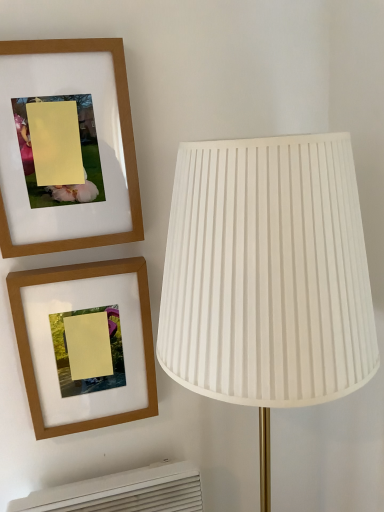
Question: Does white plastic air conditioner at lower left appear on the right side of wooden frame at upper left, the 2th picture frame from the top?

Choices:
 (A) yes
 (B) no

Answer: (A)

Question: Is white plastic air conditioner at lower left positioned with its back to wooden frame at upper left, the first picture frame ordered from the bottom?

Choices:
 (A) no
 (B) yes

Answer: (A)

Question: From a real-world perspective, is white plastic air conditioner at lower left on wooden frame at upper left, the 2th picture frame from the top?

Choices:
 (A) no
 (B) yes

Answer: (A)

Question: Is white plastic air conditioner at lower left directly adjacent to wooden frame at upper left, the first picture frame ordered from the bottom?

Choices:
 (A) yes
 (B) no

Answer: (B)

Question: Is there a large distance between white plastic air conditioner at lower left and wooden frame at upper left, the first picture frame ordered from the bottom?

Choices:
 (A) yes
 (B) no

Answer: (B)

Question: From a real-world perspective, is white plastic air conditioner at lower left under wooden frame at upper left, the 2th picture frame from the top?

Choices:
 (A) yes
 (B) no

Answer: (A)

Question: From a real-world perspective, is white pleated fabric lampshade at right located beneath wooden frame at upper left, the first picture frame ordered from the bottom?

Choices:
 (A) no
 (B) yes

Answer: (B)

Question: Could you tell me if white pleated fabric lampshade at right is facing wooden frame at upper left, the first picture frame ordered from the bottom?

Choices:
 (A) yes
 (B) no

Answer: (B)

Question: Is white pleated fabric lampshade at right bigger than wooden frame at upper left, the 2th picture frame from the top?

Choices:
 (A) no
 (B) yes

Answer: (B)

Question: Is white pleated fabric lampshade at right in contact with wooden frame at upper left, the first picture frame ordered from the bottom?

Choices:
 (A) no
 (B) yes

Answer: (A)

Question: Is white pleated fabric lampshade at right oriented away from wooden frame at upper left, the first picture frame ordered from the bottom?

Choices:
 (A) no
 (B) yes

Answer: (A)

Question: Can you confirm if white pleated fabric lampshade at right is thinner than wooden frame at upper left, the first picture frame ordered from the bottom?

Choices:
 (A) yes
 (B) no

Answer: (B)

Question: Can you see white plastic air conditioner at lower left touching wooden frame at upper left, which appears as the second picture frame when ordered from the bottom?

Choices:
 (A) yes
 (B) no

Answer: (B)